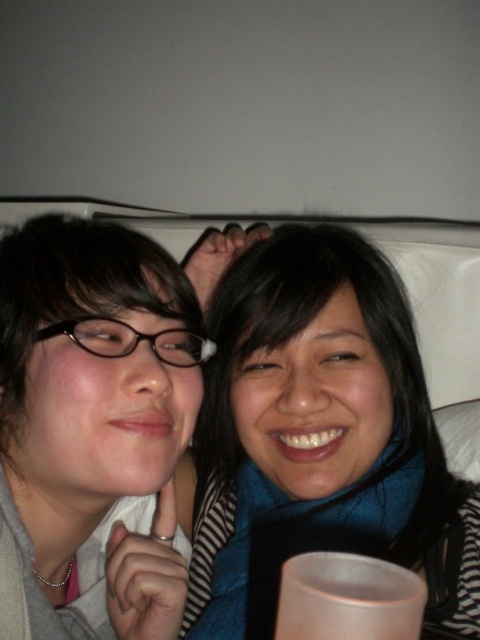
Question: Considering the relative positions of blue fabric scarf at upper center and white matte cup at lower center in the image provided, where is blue fabric scarf at upper center located with respect to white matte cup at lower center?

Choices:
 (A) left
 (B) right

Answer: (B)

Question: Which point is closer to the camera?

Choices:
 (A) (360, 580)
 (B) (423, 486)

Answer: (A)

Question: Can you confirm if blue fabric scarf at upper center is smaller than white matte cup at lower center?

Choices:
 (A) no
 (B) yes

Answer: (A)

Question: Is blue fabric scarf at upper center bigger than white matte cup at lower center?

Choices:
 (A) yes
 (B) no

Answer: (A)